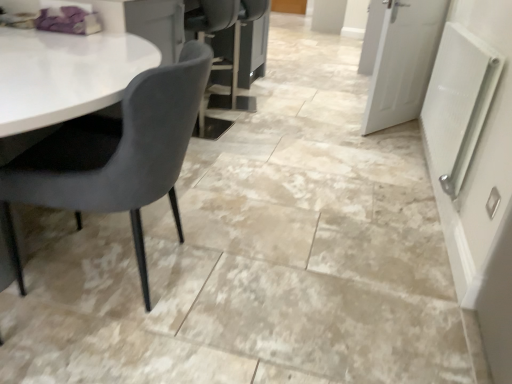
What do you see at coordinates (115, 155) in the screenshot?
I see `velvet grey chair at left` at bounding box center [115, 155].

How much space does white matte door at upper right, acting as the 2th door starting from the back, occupy horizontally?

white matte door at upper right, acting as the 2th door starting from the back, is 6.12 inches in width.

The image size is (512, 384). Find the location of `velvet grey chair at left`. velvet grey chair at left is located at coordinates (115, 155).

From the image's perspective, who appears lower, white painted wood door at upper right, the second door from the bottom, or velvet grey chair at left?

velvet grey chair at left.

Starting from the velvet grey chair at left, which door is the 2nd one behind? Please provide its 2D coordinates.

[(372, 36)]

Can you confirm if white painted wood door at upper right, which is the second door in front-to-back order, is bigger than velvet grey chair at left?

Indeed, white painted wood door at upper right, which is the second door in front-to-back order, has a larger size compared to velvet grey chair at left.

How distant is white painted wood door at upper right, the first door from the top, from velvet grey chair at left?

A distance of 3.97 meters exists between white painted wood door at upper right, the first door from the top, and velvet grey chair at left.

From the white textured radiator at right, count 2nd door to the right and point to it. Please provide its 2D coordinates.

[(372, 36)]

Is white painted wood door at upper right, the 1th door in the back-to-front sequence, in front of or behind white textured radiator at right in the image?

Visually, white painted wood door at upper right, the 1th door in the back-to-front sequence, is located behind white textured radiator at right.

Can you tell me how much white painted wood door at upper right, the 1th door in the back-to-front sequence, and white textured radiator at right differ in facing direction?

0.311 degrees.

Is point (361, 62) less distant than point (446, 78)?

No.

Which object is further away from the camera, white painted wood door at upper right, the second door from the bottom, or white matte door at upper right, the 1th door positioned from the front?

white painted wood door at upper right, the second door from the bottom, is behind.

Is point (368, 34) in front of point (407, 29)?

No, it is not.

From the image's perspective, is white painted wood door at upper right, which is the second door in front-to-back order, located beneath white matte door at upper right, positioned as the second door in top-to-bottom order?

No.

The height and width of the screenshot is (384, 512). In the image, there is a white matte door at upper right, positioned as the second door in top-to-bottom order. In order to click on door above it (from the image's perspective) in this screenshot , I will do click(x=372, y=36).

Is white textured radiator at right inside velvet grey chair at left?

No, white textured radiator at right is not inside velvet grey chair at left.

How different are the orientations of velvet grey chair at left and white textured radiator at right in degrees?

They differ by 11.4 degrees in their facing directions.

In terms of width, does velvet grey chair at left look wider or thinner when compared to white textured radiator at right?

velvet grey chair at left is wider than white textured radiator at right.

Is velvet grey chair at left taller than white textured radiator at right?

Correct, velvet grey chair at left is much taller as white textured radiator at right.

Is velvet grey chair at left shorter than white matte door at upper right, which ranks as the first door in bottom-to-top order?

Yes.

Between velvet grey chair at left and white matte door at upper right, acting as the 2th door starting from the back, which one appears on the left side from the viewer's perspective?

velvet grey chair at left.

Considering the positions of objects velvet grey chair at left and white matte door at upper right, the 1th door positioned from the front, in the image provided, who is in front, velvet grey chair at left or white matte door at upper right, the 1th door positioned from the front,?

velvet grey chair at left is closer to the camera.

Is point (383, 41) positioned behind point (457, 114)?

Yes, it is.

Are white matte door at upper right, the 1th door positioned from the front, and white textured radiator at right far apart?

Actually, white matte door at upper right, the 1th door positioned from the front, and white textured radiator at right are a little close together.

In terms of height, does white matte door at upper right, which ranks as the first door in bottom-to-top order, look taller or shorter compared to white textured radiator at right?

In the image, white matte door at upper right, which ranks as the first door in bottom-to-top order, appears to be taller than white textured radiator at right.

From a real-world perspective, is white textured radiator at right positioned over white matte door at upper right, positioned as the second door in top-to-bottom order, based on gravity?

Correct, in the physical world, white textured radiator at right is higher than white matte door at upper right, positioned as the second door in top-to-bottom order.

Can you confirm if white textured radiator at right is bigger than white matte door at upper right, which ranks as the first door in bottom-to-top order?

Incorrect, white textured radiator at right is not larger than white matte door at upper right, which ranks as the first door in bottom-to-top order.

The height and width of the screenshot is (384, 512). I want to click on door that is the 1st object located behind the white textured radiator at right, so click(403, 61).

From the image's perspective, starting from the velvet grey chair at left, which door is the 2nd one above? Please provide its 2D coordinates.

[(372, 36)]

Identify the location of radiator that appears in front of the white painted wood door at upper right, the second door from the bottom. (458, 103).

Based on their spatial positions, is white painted wood door at upper right, the second door from the bottom, or velvet grey chair at left closer to white matte door at upper right, the 1th door positioned from the front?

white painted wood door at upper right, the second door from the bottom, is closer to white matte door at upper right, the 1th door positioned from the front.

Estimate the real-world distances between objects in this image. Which object is further from white textured radiator at right, white painted wood door at upper right, the 1th door in the back-to-front sequence, or white matte door at upper right, which ranks as the first door in bottom-to-top order?

white painted wood door at upper right, the 1th door in the back-to-front sequence, is further to white textured radiator at right.

Based on their spatial positions, is white matte door at upper right, which ranks as the first door in bottom-to-top order, or white painted wood door at upper right, which is the second door in front-to-back order, further from velvet grey chair at left?

Based on the image, white painted wood door at upper right, which is the second door in front-to-back order, appears to be further to velvet grey chair at left.

Considering their positions, is white painted wood door at upper right, the first door from the top, positioned closer to velvet grey chair at left than white matte door at upper right, the 1th door positioned from the front?

Among the two, white matte door at upper right, the 1th door positioned from the front, is located nearer to velvet grey chair at left.

When comparing their distances from white matte door at upper right, the 1th door positioned from the front, does white textured radiator at right or velvet grey chair at left seem further?

velvet grey chair at left is positioned further to the anchor white matte door at upper right, the 1th door positioned from the front.

Which object lies nearer to the anchor point white matte door at upper right, positioned as the second door in top-to-bottom order, velvet grey chair at left or white textured radiator at right?

white textured radiator at right is positioned closer to the anchor white matte door at upper right, positioned as the second door in top-to-bottom order.

Estimate the real-world distances between objects in this image. Which object is closer to white matte door at upper right, positioned as the second door in top-to-bottom order, white painted wood door at upper right, the first door from the top, or white textured radiator at right?

white textured radiator at right lies closer to white matte door at upper right, positioned as the second door in top-to-bottom order, than the other object.

When comparing their distances from white textured radiator at right, does white matte door at upper right, acting as the 2th door starting from the back, or velvet grey chair at left seem further?

Based on the image, velvet grey chair at left appears to be further to white textured radiator at right.

At what (x,y) coordinates should I click in order to perform the action: click on radiator located between velvet grey chair at left and white painted wood door at upper right, which is the second door in front-to-back order, in the depth direction. Please return your answer as a coordinate pair (x, y). The image size is (512, 384). Looking at the image, I should click on (458, 103).

At what (x,y) coordinates should I click in order to perform the action: click on door positioned between white textured radiator at right and white painted wood door at upper right, which is the second door in front-to-back order, from near to far. Please return your answer as a coordinate pair (x, y). Looking at the image, I should click on (403, 61).

You are a GUI agent. You are given a task and a screenshot of the screen. Output one action in this format:
    pyautogui.click(x=<x>, y=<y>)
    Task: Click on the door between velvet grey chair at left and white painted wood door at upper right, the first door from the top, in the front-back direction
    This screenshot has width=512, height=384.
    Given the screenshot: What is the action you would take?
    pyautogui.click(x=403, y=61)

Locate an element on the screen. radiator between velvet grey chair at left and white matte door at upper right, the 1th door positioned from the front is located at coordinates (458, 103).